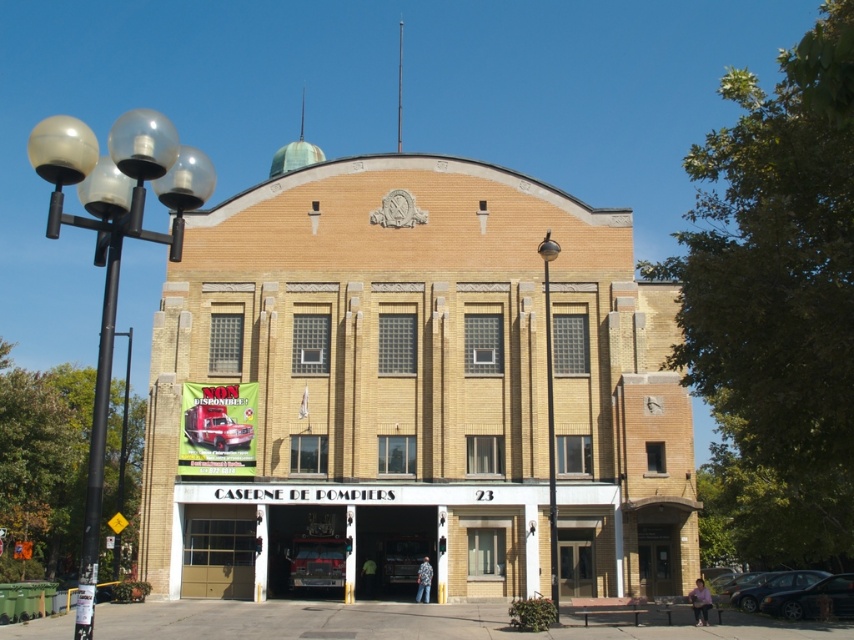
Question: Does dark green matte car at lower right appear on the left side of shiny black car at lower right?

Choices:
 (A) yes
 (B) no

Answer: (B)

Question: Which of the following is the farthest from the observer?

Choices:
 (A) (787, 589)
 (B) (203, 316)

Answer: (B)

Question: Which of the following is the closest to the observer?

Choices:
 (A) shiny black car at lower right
 (B) yellow brick building at center
 (C) dark green matte car at lower right
 (D) shiny black sedan at lower right

Answer: (D)

Question: Is dark green matte car at lower right positioned behind shiny black car at lower right?

Choices:
 (A) no
 (B) yes

Answer: (A)

Question: Can you confirm if yellow brick building at center is smaller than dark green matte car at lower right?

Choices:
 (A) yes
 (B) no

Answer: (B)

Question: Which object is positioned closest to the shiny black sedan at lower right?

Choices:
 (A) dark green matte car at lower right
 (B) yellow brick building at center

Answer: (A)